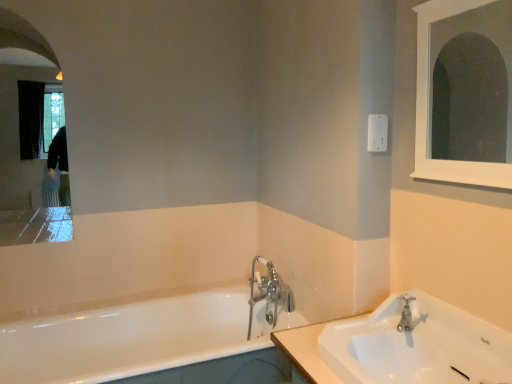
Question: Is white glossy sink at lower right shorter than silver metallic faucet at sink right, marked as the second tap in a back-to-front arrangement?

Choices:
 (A) yes
 (B) no

Answer: (B)

Question: Is white glossy sink at lower right placed right next to silver metallic faucet at sink right, which is counted as the 1th tap, starting from the front?

Choices:
 (A) no
 (B) yes

Answer: (A)

Question: Does white glossy sink at lower right contain silver metallic faucet at sink right, positioned as the 2th tap in left-to-right order?

Choices:
 (A) yes
 (B) no

Answer: (A)

Question: Can you confirm if white glossy sink at lower right is positioned to the right of silver metallic faucet at sink right, positioned as the 2th tap in left-to-right order?

Choices:
 (A) no
 (B) yes

Answer: (A)

Question: Is white glossy sink at lower right oriented towards silver metallic faucet at sink right, positioned as the 2th tap in left-to-right order?

Choices:
 (A) no
 (B) yes

Answer: (A)

Question: From the image's perspective, is white glossy sink at lower right below silver metallic faucet at sink right, which is counted as the 1th tap, starting from the front?

Choices:
 (A) no
 (B) yes

Answer: (B)

Question: Can you confirm if white wooden medicine cabinet at upper right, which ranks as the second medicine cabinet in left-to-right order, is positioned to the right of white glossy bathtub at lower left?

Choices:
 (A) no
 (B) yes

Answer: (B)

Question: Would you say white wooden medicine cabinet at upper right, which ranks as the second medicine cabinet in left-to-right order, is outside white glossy bathtub at lower left?

Choices:
 (A) yes
 (B) no

Answer: (A)

Question: Considering the relative sizes of white wooden medicine cabinet at upper right, placed as the first medicine cabinet when sorted from front to back, and white glossy bathtub at lower left in the image provided, is white wooden medicine cabinet at upper right, placed as the first medicine cabinet when sorted from front to back, wider than white glossy bathtub at lower left?

Choices:
 (A) yes
 (B) no

Answer: (B)

Question: Does white wooden medicine cabinet at upper right, arranged as the 2th medicine cabinet when viewed from the back, have a smaller size compared to white glossy bathtub at lower left?

Choices:
 (A) yes
 (B) no

Answer: (A)

Question: Is white wooden medicine cabinet at upper right, arranged as the 2th medicine cabinet when viewed from the back, shorter than white glossy bathtub at lower left?

Choices:
 (A) yes
 (B) no

Answer: (B)

Question: From the image's perspective, is white wooden medicine cabinet at upper right, arranged as the 2th medicine cabinet when viewed from the back, below white glossy bathtub at lower left?

Choices:
 (A) no
 (B) yes

Answer: (A)

Question: Is white wooden medicine cabinet at upper right, arranged as the 2th medicine cabinet when viewed from the back, facing towards white glossy sink at lower right?

Choices:
 (A) yes
 (B) no

Answer: (B)